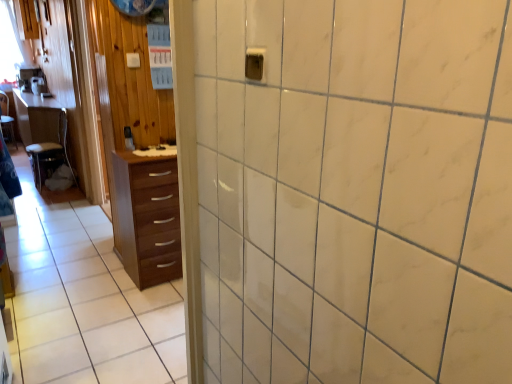
Question: Looking at their shapes, would you say wooden chair at left is wider or thinner than wooden table at left?

Choices:
 (A) wide
 (B) thin

Answer: (B)

Question: Is point (39, 145) closer or farther from the camera than point (23, 142)?

Choices:
 (A) closer
 (B) farther

Answer: (A)

Question: Estimate the real-world distances between objects in this image. Which object is closer to the wooden chair at left?

Choices:
 (A) wooden table at left
 (B) brown wood chest of drawers at left

Answer: (A)

Question: Estimate the real-world distances between objects in this image. Which object is farther from the brown wood chest of drawers at left?

Choices:
 (A) wooden table at left
 (B) wooden chair at left

Answer: (A)